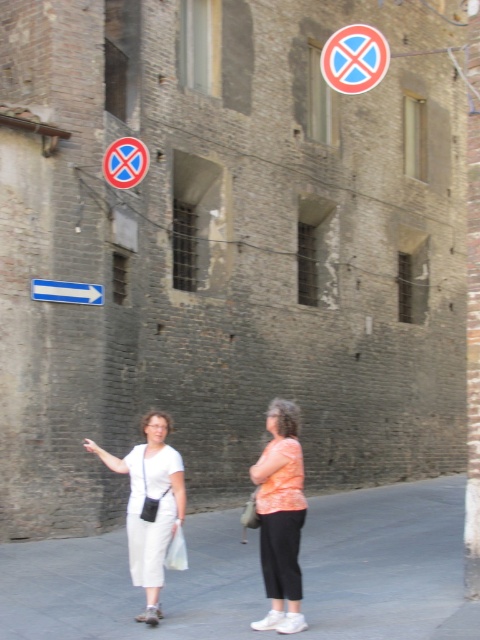
You are standing on the street in front of the building and want to know which of the two points, point (299, 618) or point (331, 52), is closer to you. Based on the scene description, can you determine which point is nearer?

Point (299, 618) is closer to the viewer than point (331, 52).

You are a pedestrian standing on the street in front of the weathered brick building. You see the white cotton pants at lower left and the blue circular sign at upper left. Which object is nearer to you?

The white cotton pants at lower left is closer to the viewer than the blue circular sign at upper left.

You are a delivery person trying to park your bike. You see the white cotton pants at lower left and the blue circular sign at upper left. Which object is wider?

The white cotton pants at lower left is wider than the blue circular sign at upper left.